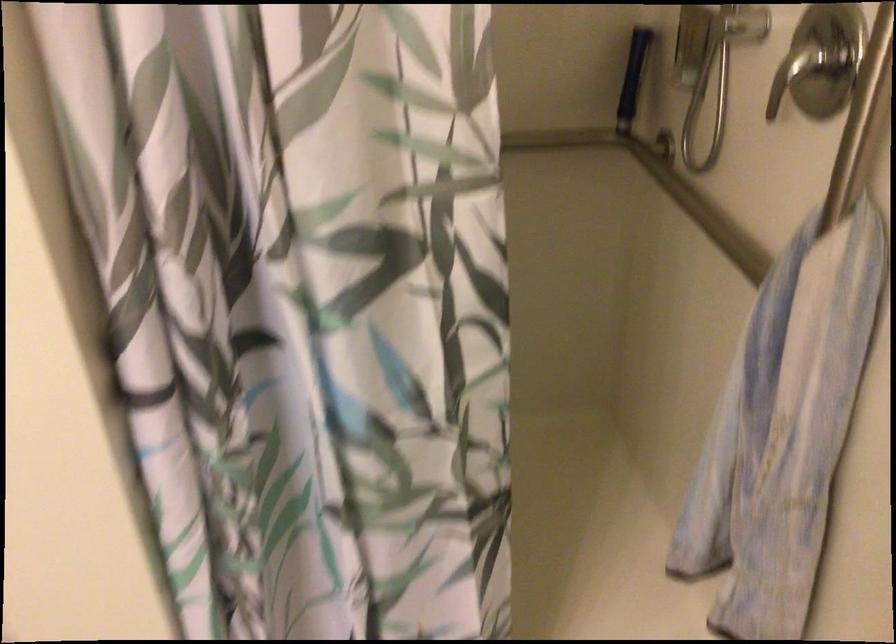
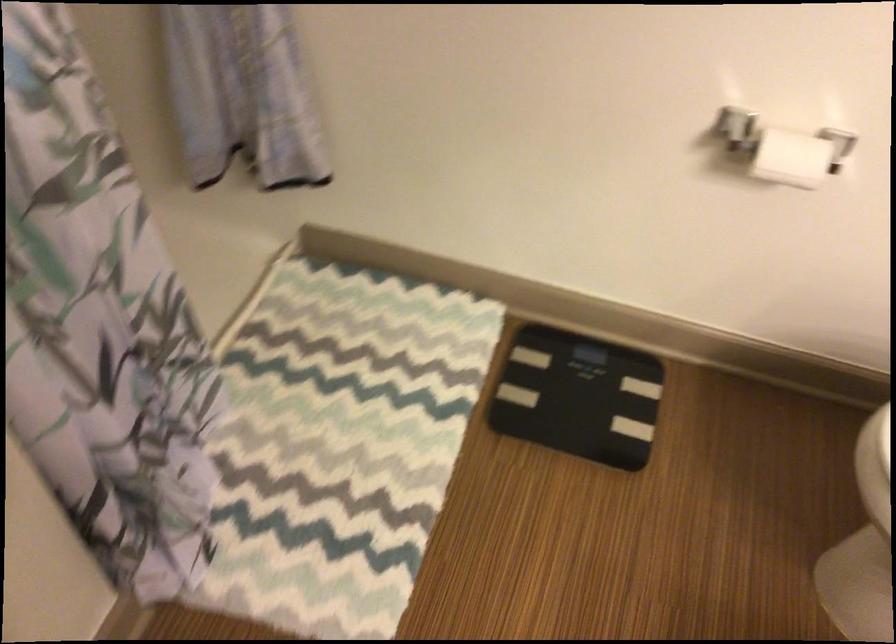
The first image is from the beginning of the video and the second image is from the end. How did the camera likely rotate when shooting the video?

The camera's rotation is toward right-down.